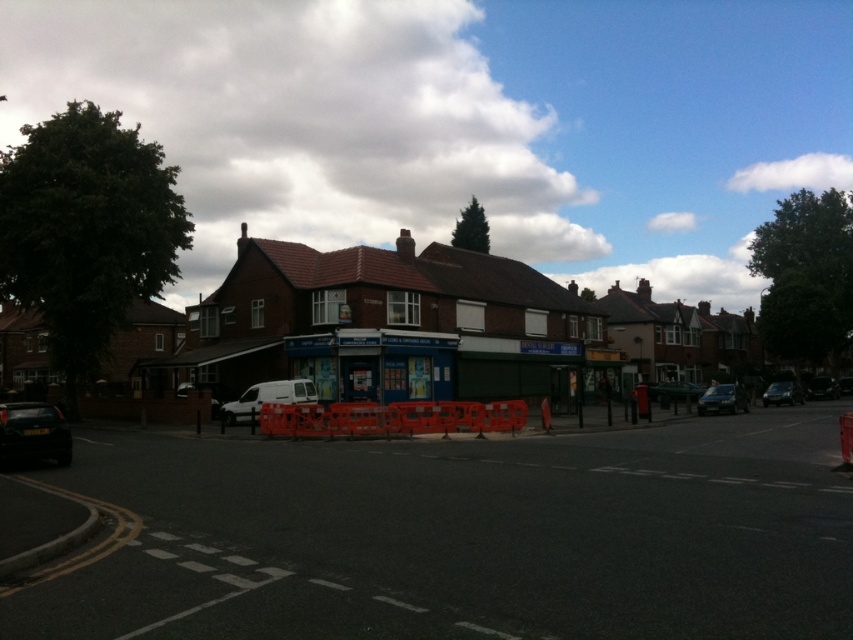
Question: Considering the real-world distances, which object is farthest from the shiny black car at right?

Choices:
 (A) shiny black car at lower left
 (B) black asphalt road at center

Answer: (A)

Question: Where is shiny silver car at right located in relation to shiny black car at right in the image?

Choices:
 (A) right
 (B) left

Answer: (B)

Question: Which point is farther to the camera?

Choices:
 (A) (822, 384)
 (B) (540, 497)

Answer: (A)

Question: Which is farther from the shiny silver car at center?

Choices:
 (A) metallic silver car at center
 (B) shiny black car at right
 (C) blue painted bus stop at center

Answer: (B)

Question: Can you confirm if metallic silver car at center is positioned to the left of shiny silver car at right?

Choices:
 (A) yes
 (B) no

Answer: (A)

Question: Can you confirm if black asphalt road at center is thinner than shiny black car at right?

Choices:
 (A) no
 (B) yes

Answer: (A)